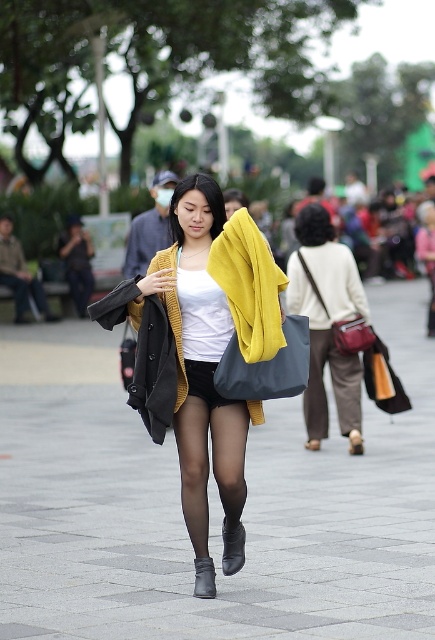
You are a photographer who wants to ensure the subject remains in focus while capturing the background details. Since the brown fabric pants at lower center and leather boot at center are part of the subject, which object should you focus on to keep both in focus?

To keep both the brown fabric pants at lower center and the leather boot at center in focus, you should focus on the brown fabric pants at lower center since it is positioned over the leather boot at center, ensuring the closer object remains sharp while the background blurs slightly.

You are a photographer who wants to ensure that both the matte yellow sweater at center and the black leather boot at lower center are clearly visible in your photo. Based on the scene description, which object might be partially obscured if the depth of field is too shallow?

The black leather boot at lower center might be partially obscured because the matte yellow sweater at center is positioned over it, and the shallow depth of field could blur the background elements, including the boot.

You are a photographer trying to capture the young woman in the image. You notice the brown fabric pants at lower center and the leather boot at center. Which of these two items is wider in the photo?

The brown fabric pants at lower center might be wider than the leather boot at center according to the description.